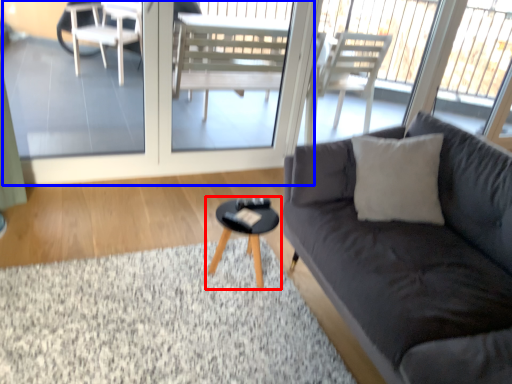
Question: Which of the following is the closest to the observer, coffee table (highlighted by a red box) or screen door (highlighted by a blue box)?

Choices:
 (A) coffee table
 (B) screen door

Answer: (A)